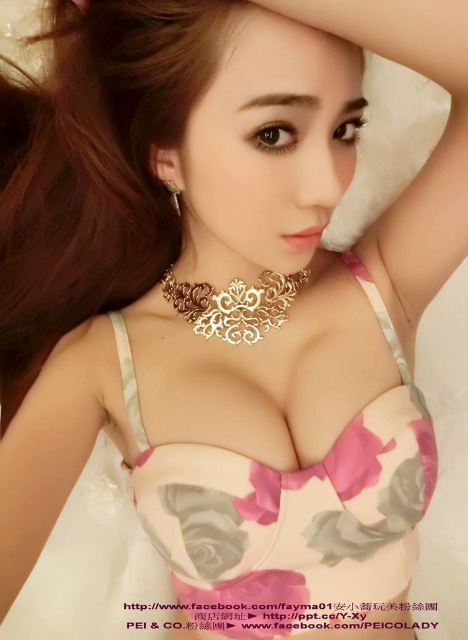
Who is shorter, pink floral fabric bikini top at center or gold metallic necklace at center?

gold metallic necklace at center is shorter.

Does pink floral fabric bikini top at center appear on the right side of gold metallic necklace at center?

Yes, pink floral fabric bikini top at center is to the right of gold metallic necklace at center.

The width and height of the screenshot is (468, 640). I want to click on pink floral fabric bikini top at center, so click(290, 509).

At what (x,y) coordinates should I click in order to perform the action: click on pink floral fabric bikini top at center. Please return your answer as a coordinate pair (x, y). This screenshot has width=468, height=640. Looking at the image, I should click on (290, 509).